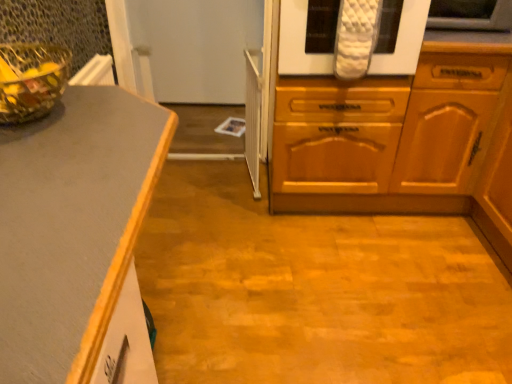
Question: Should I look upward or downward to see white quilted oven mitts at upper center?

Choices:
 (A) down
 (B) up

Answer: (B)

Question: Is white quilted oven mitt at upper right looking in the opposite direction of transparent glass bowl at upper left?

Choices:
 (A) yes
 (B) no

Answer: (B)

Question: From the image's perspective, is white quilted oven mitt at upper right located above transparent glass bowl at upper left?

Choices:
 (A) no
 (B) yes

Answer: (B)

Question: Can you confirm if white quilted oven mitt at upper right is positioned to the left of transparent glass bowl at upper left?

Choices:
 (A) yes
 (B) no

Answer: (B)

Question: Can you confirm if white quilted oven mitt at upper right is thinner than transparent glass bowl at upper left?

Choices:
 (A) yes
 (B) no

Answer: (B)

Question: Is white quilted oven mitt at upper right bigger than transparent glass bowl at upper left?

Choices:
 (A) yes
 (B) no

Answer: (A)

Question: From a real-world perspective, does white quilted oven mitt at upper right sit lower than transparent glass bowl at upper left?

Choices:
 (A) yes
 (B) no

Answer: (A)

Question: Is white quilted oven mitts at upper center at the left side of transparent glass bowl at upper left?

Choices:
 (A) yes
 (B) no

Answer: (B)

Question: Is white quilted oven mitts at upper center closer to camera compared to transparent glass bowl at upper left?

Choices:
 (A) no
 (B) yes

Answer: (A)

Question: Can you confirm if white quilted oven mitts at upper center is taller than transparent glass bowl at upper left?

Choices:
 (A) no
 (B) yes

Answer: (B)

Question: Is white quilted oven mitts at upper center smaller than transparent glass bowl at upper left?

Choices:
 (A) yes
 (B) no

Answer: (B)

Question: From the image's perspective, is white quilted oven mitts at upper center over transparent glass bowl at upper left?

Choices:
 (A) yes
 (B) no

Answer: (A)

Question: Is white quilted oven mitts at upper center positioned with its back to transparent glass bowl at upper left?

Choices:
 (A) no
 (B) yes

Answer: (A)

Question: Is white quilted oven mitts at upper center with white quilted oven mitt at upper right?

Choices:
 (A) yes
 (B) no

Answer: (B)